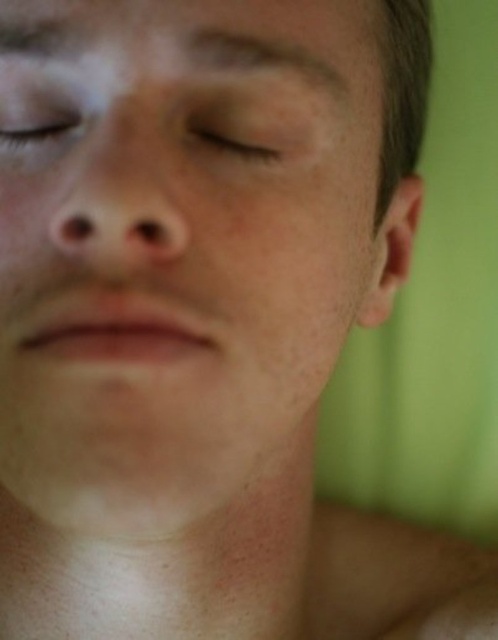
Question: Which object appears closest to the camera in this image?

Choices:
 (A) matte skin at center
 (B) matte skin eye at upper center
 (C) smooth skin face at center

Answer: (C)

Question: Among these points, which one is nearest to the camera?

Choices:
 (A) (266, 92)
 (B) (52, 144)
 (C) (262, 150)

Answer: (A)

Question: Which object is positioned closest to the matte skin eye at upper center?

Choices:
 (A) matte skin at center
 (B) smooth skin face at center

Answer: (A)

Question: Can you confirm if matte skin at center is positioned to the right of matte skin eye at upper center?

Choices:
 (A) no
 (B) yes

Answer: (B)

Question: Can you confirm if matte skin at center is smaller than matte skin eye at upper center?

Choices:
 (A) yes
 (B) no

Answer: (B)

Question: Does smooth skin face at center come in front of matte skin eye at upper center?

Choices:
 (A) yes
 (B) no

Answer: (A)